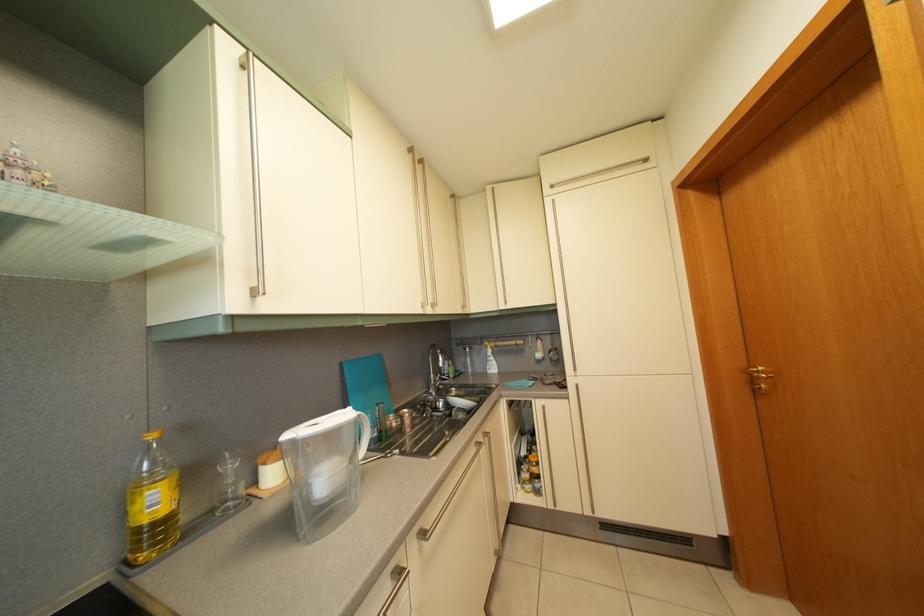
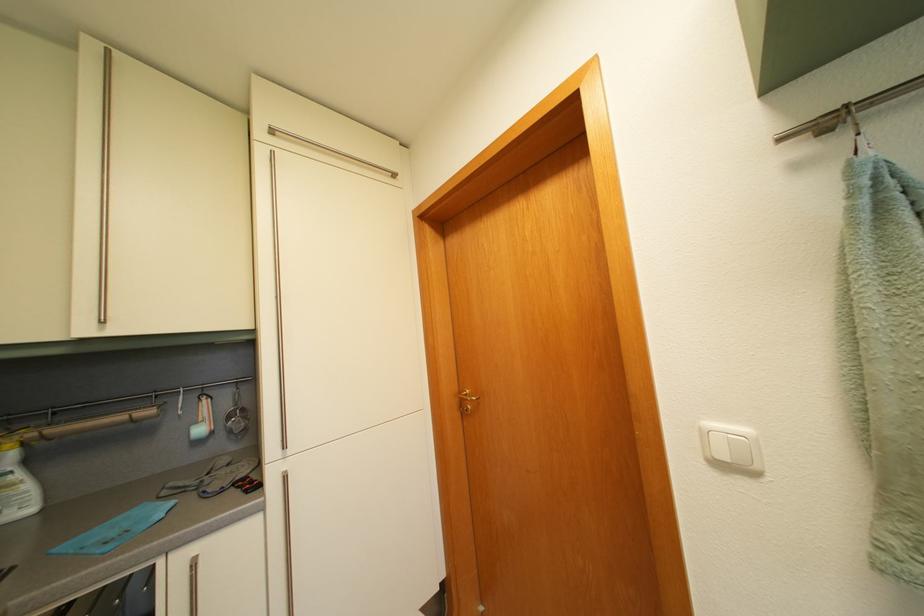
In the second image, find the point that corresponds to point 562,188 in the first image.

(284, 132)